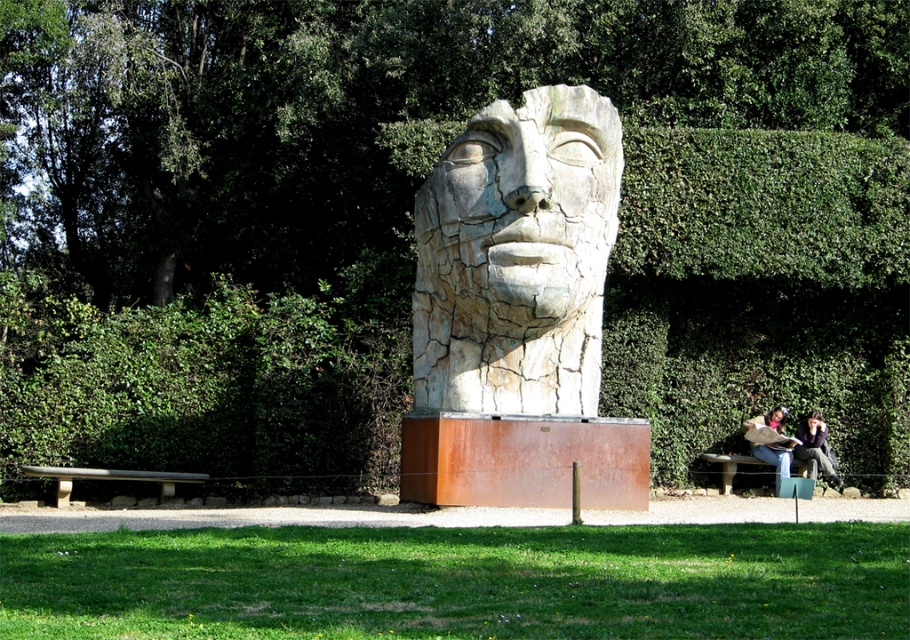
Question: Is rustic metal bench at lower left below rustic wood bench at lower right?

Choices:
 (A) yes
 (B) no

Answer: (B)

Question: Estimate the real-world distances between objects in this image. Which object is farther from the matte black jacket at lower right?

Choices:
 (A) rustic wood bench at lower right
 (B) rustic metal bench at lower left
 (C) smooth pink face at center

Answer: (B)

Question: Which object is farther from the camera taking this photo?

Choices:
 (A) cracked stone head at center
 (B) rustic metal bench at lower left
 (C) matte black jacket at lower right
 (D) matte brown bench at lower right

Answer: (C)

Question: Where is cracked stone head at center located in relation to rustic metal bench at lower left in the image?

Choices:
 (A) left
 (B) right

Answer: (B)

Question: Which of the following is the closest to the observer?

Choices:
 (A) rustic wood bench at lower right
 (B) matte brown bench at lower right
 (C) rustic metal bench at lower left

Answer: (C)

Question: Does matte black jacket at lower right have a lesser width compared to rustic wood bench at lower right?

Choices:
 (A) no
 (B) yes

Answer: (B)